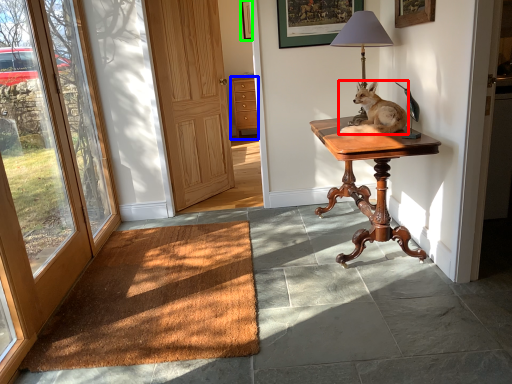
Question: Which is farther away from dog (highlighted by a red box)? cabinetry (highlighted by a blue box) or picture frame (highlighted by a green box)?

Choices:
 (A) cabinetry
 (B) picture frame

Answer: (A)